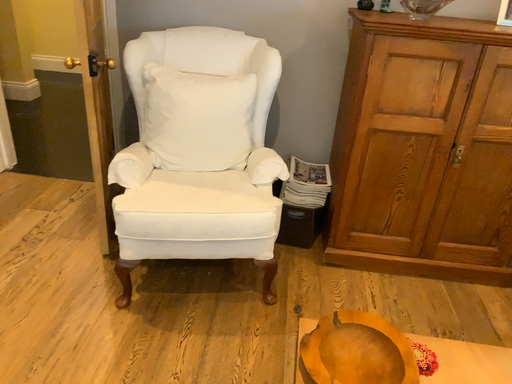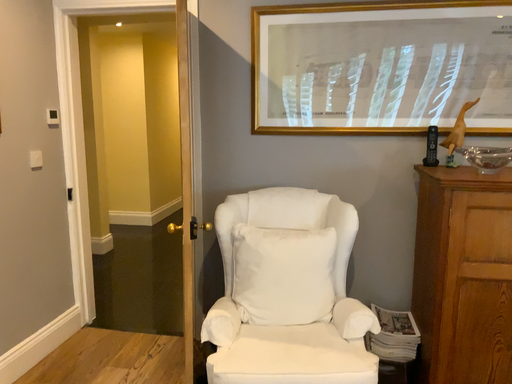
Question: How did the camera likely rotate when shooting the video?

Choices:
 (A) rotated downward
 (B) rotated upward

Answer: (B)